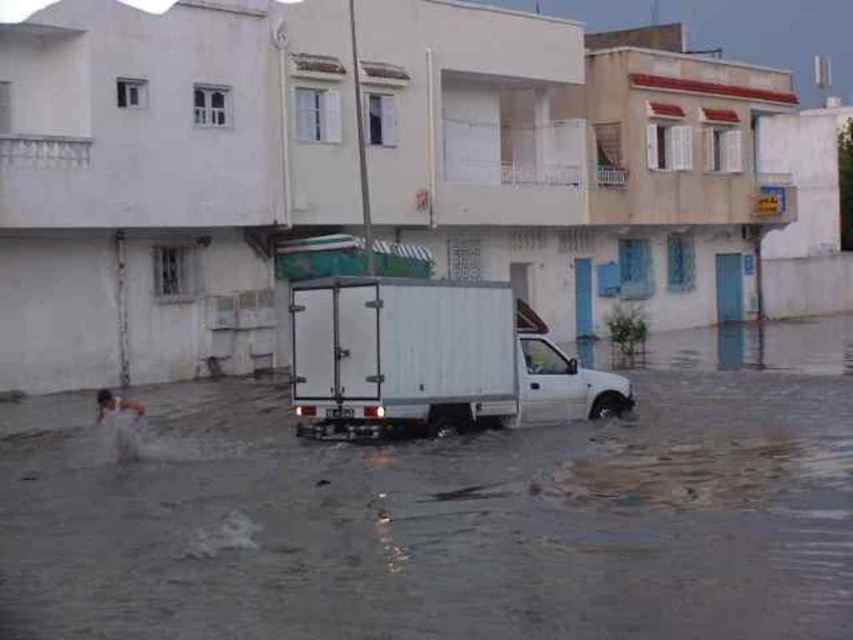
Who is lower down, clear water at truck center or white matte truck at center?

Positioned lower is clear water at truck center.

Between point (332, 620) and point (456, 317), which one is positioned in front?

Point (332, 620) is in front.

Does point (795, 444) lie behind point (355, 282)?

Yes, point (795, 444) is farther from viewer.

Find the location of a particular element. clear water at truck center is located at coordinates (450, 513).

Is point (450, 481) positioned before point (608, 497)?

That is False.

Is clear water at truck center wider than translucent wet surface at lower center?

Correct, the width of clear water at truck center exceeds that of translucent wet surface at lower center.

The width and height of the screenshot is (853, 640). Identify the location of clear water at truck center. (450, 513).

The image size is (853, 640). Find the location of `clear water at truck center`. clear water at truck center is located at coordinates (450, 513).

Between white matte truck at center and translucent wet surface at lower center, which one appears on the left side from the viewer's perspective?

white matte truck at center

Who is more distant from viewer, (422, 346) or (839, 468)?

The point (422, 346) is behind.

Identify the location of white matte truck at center. The height and width of the screenshot is (640, 853). (431, 360).